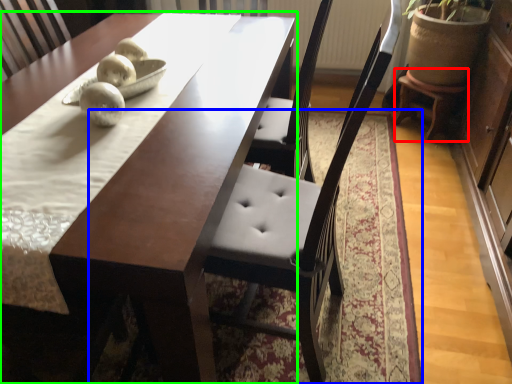
Question: Estimate the real-world distances between objects in this image. Which object is farther from stool (highlighted by a red box), mat (highlighted by a blue box) or table (highlighted by a green box)?

Choices:
 (A) mat
 (B) table

Answer: (B)